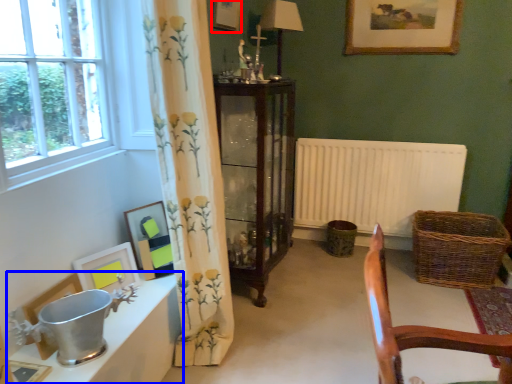
Question: Which object appears closest to the camera in this image, picture frame (highlighted by a red box) or table (highlighted by a blue box)?

Choices:
 (A) picture frame
 (B) table

Answer: (B)